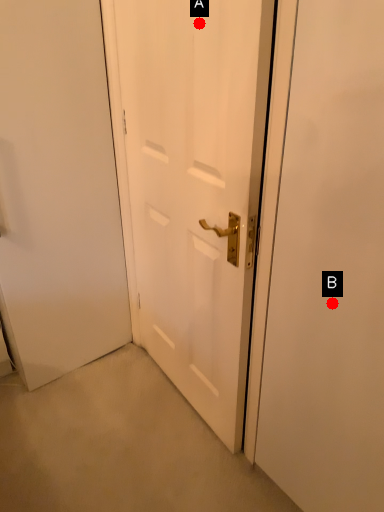
Question: Two points are circled on the image, labeled by A and B beside each circle. Which point is closer to the camera?

Choices:
 (A) A is closer
 (B) B is closer

Answer: (B)